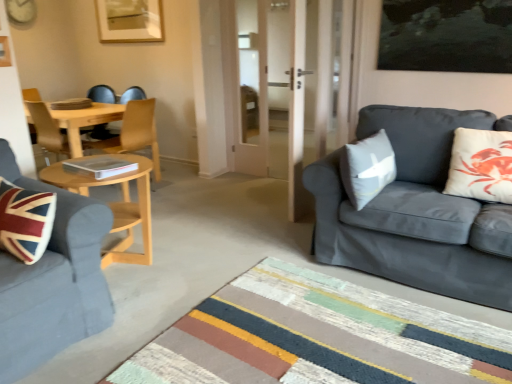
You are a GUI agent. You are given a task and a screenshot of the screen. Output one action in this format:
    pyautogui.click(x=<x>, y=<y>)
    Task: Click on the empty space that is ontop of striped rug at center (from a real-world perspective)
    
    Given the screenshot: What is the action you would take?
    pyautogui.click(x=321, y=334)